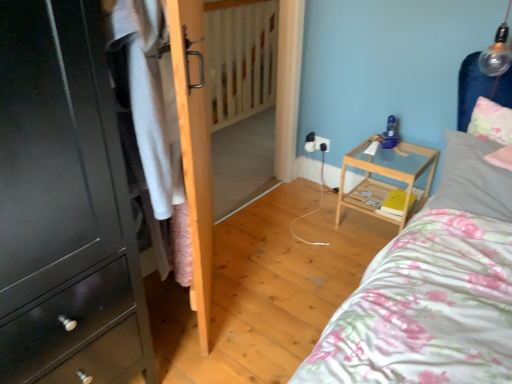
Where is `free space that is in between light wood/transparent glass nightstand at center-right and wooden door at left`? free space that is in between light wood/transparent glass nightstand at center-right and wooden door at left is located at coordinates (291, 263).